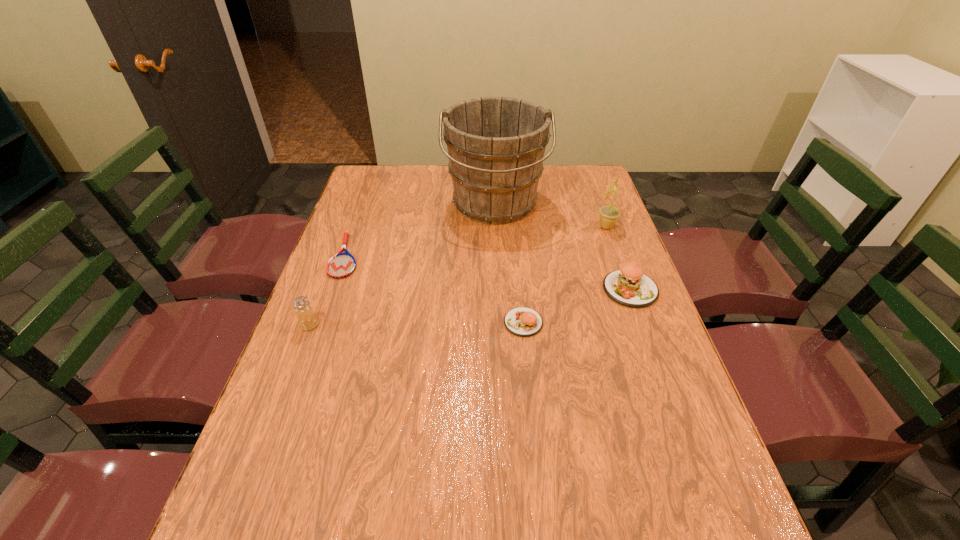
Locate an element on the screen. free space between the tennis racket and the sunflower is located at coordinates 476,241.

Where is `vacant space that is in between the taller patty and the saltshaker`? The width and height of the screenshot is (960, 540). vacant space that is in between the taller patty and the saltshaker is located at coordinates (469, 307).

This screenshot has width=960, height=540. I want to click on vacant area between the right patty and the fifth shortest object, so click(x=618, y=258).

Find the location of `empty space between the tallest object and the fourth tallest object`. empty space between the tallest object and the fourth tallest object is located at coordinates (563, 247).

This screenshot has width=960, height=540. I want to click on free space that is in between the shortest object and the third tallest object, so click(327, 291).

Find the location of `free area in between the shortest object and the second shortest object`. free area in between the shortest object and the second shortest object is located at coordinates (435, 289).

Locate which object is the closest to the sunflower. Please provide its 2D coordinates. Your answer should be formatted as a tuple, i.e. [(x, y)], where the tuple contains the x and y coordinates of a point satisfying the conditions above.

[(496, 145)]

Identify which object is the third nearest to the tallest object. Please provide its 2D coordinates. Your answer should be formatted as a tuple, i.e. [(x, y)], where the tuple contains the x and y coordinates of a point satisfying the conditions above.

[(341, 265)]

In order to click on vacant space that satisfies the following two spatial constraints: 1. on the face of the fifth shortest object; 2. on the front side of the shorter patty in this screenshot , I will do `click(641, 322)`.

At what (x,y) coordinates should I click in order to perform the action: click on vacant area that satisfies the following two spatial constraints: 1. on the front side of the shortest object; 2. on the right side of the left patty. Please return your answer as a coordinate pair (x, y). Image resolution: width=960 pixels, height=540 pixels. Looking at the image, I should click on (323, 322).